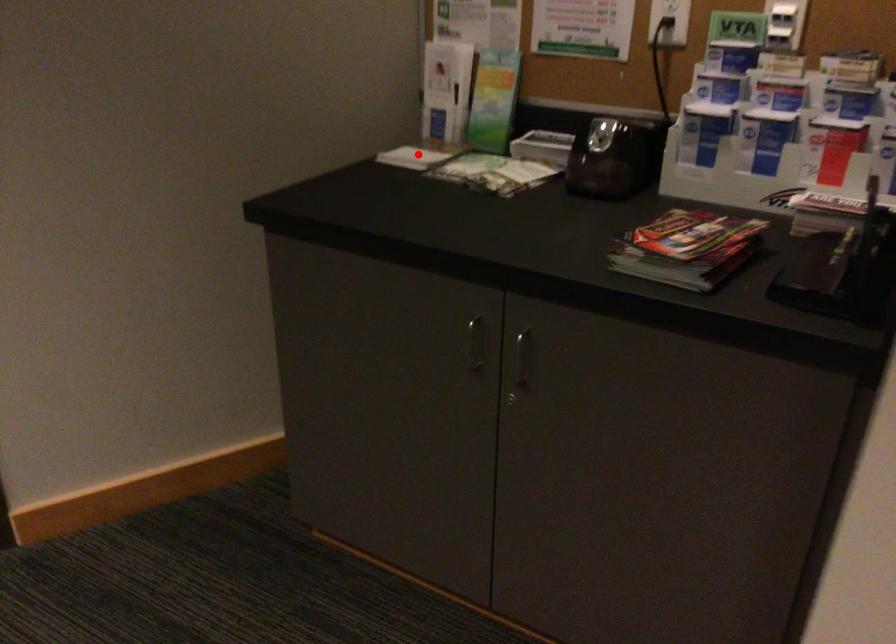
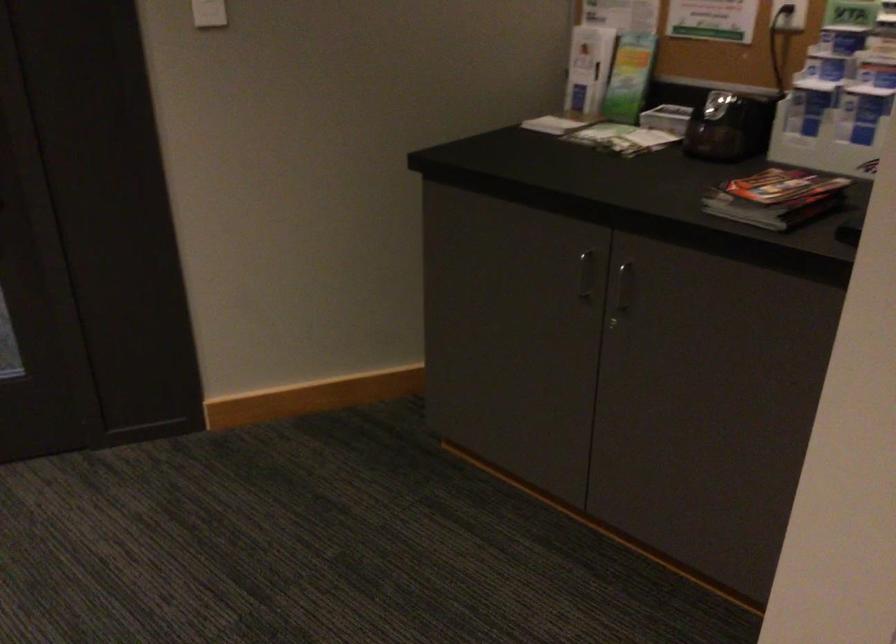
Question: I am providing you with two images of the same scene from different viewpoints. Given a red point in image1, look at the same physical point in image2. Is it:

Choices:
 (A) Closer to the viewpoint
 (B) Farther from the viewpoint

Answer: (B)